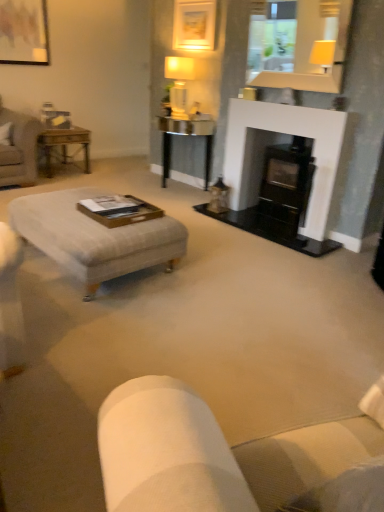
Question: Does matte white lamp at upper center have a greater width compared to matte gold picture frame at upper center, the 1th picture frame positioned from the right?

Choices:
 (A) no
 (B) yes

Answer: (B)

Question: From the image's perspective, is matte white lamp at upper center above matte gold picture frame at upper center, the 1th picture frame positioned from the right?

Choices:
 (A) yes
 (B) no

Answer: (B)

Question: Is matte white lamp at upper center shorter than matte gold picture frame at upper center, the 1th picture frame positioned from the right?

Choices:
 (A) no
 (B) yes

Answer: (A)

Question: Can you confirm if matte white lamp at upper center is positioned to the left of matte gold picture frame at upper center, the 1th picture frame positioned from the right?

Choices:
 (A) no
 (B) yes

Answer: (B)

Question: From a real-world perspective, is matte white lamp at upper center under matte gold picture frame at upper center, the 1th picture frame positioned from the right?

Choices:
 (A) no
 (B) yes

Answer: (B)

Question: Is white matte fireplace at center spatially inside light gray fabric ottoman at center, or outside of it?

Choices:
 (A) outside
 (B) inside

Answer: (A)

Question: In terms of size, does white matte fireplace at center appear bigger or smaller than light gray fabric ottoman at center?

Choices:
 (A) small
 (B) big

Answer: (A)

Question: Considering the positions of point (329, 116) and point (44, 199), is point (329, 116) closer or farther from the camera than point (44, 199)?

Choices:
 (A) farther
 (B) closer

Answer: (A)

Question: From the image's perspective, is white matte fireplace at center located above or below light gray fabric ottoman at center?

Choices:
 (A) below
 (B) above

Answer: (B)

Question: Considering the positions of point (177, 31) and point (41, 31), is point (177, 31) closer or farther from the camera than point (41, 31)?

Choices:
 (A) closer
 (B) farther

Answer: (A)

Question: From a real-world perspective, is matte gold picture frame at upper center, placed as the 2th picture frame when sorted from left to right, positioned above or below matte wooden picture frame at upper left, placed as the second picture frame when sorted from right to left?

Choices:
 (A) above
 (B) below

Answer: (A)

Question: From the image's perspective, is matte gold picture frame at upper center, placed as the 2th picture frame when sorted from left to right, above or below matte wooden picture frame at upper left, placed as the 1th picture frame when sorted from left to right?

Choices:
 (A) above
 (B) below

Answer: (B)

Question: Is matte gold picture frame at upper center, placed as the 2th picture frame when sorted from left to right, taller or shorter than matte wooden picture frame at upper left, placed as the 1th picture frame when sorted from left to right?

Choices:
 (A) tall
 (B) short

Answer: (B)

Question: Would you say metallic gold table at left, marked as the 2th table in a right-to-left arrangement, is to the left or to the right of matte glass mirror at upper center in the picture?

Choices:
 (A) right
 (B) left

Answer: (B)

Question: In terms of height, does metallic gold table at left, marked as the first table in a left-to-right arrangement, look taller or shorter compared to matte glass mirror at upper center?

Choices:
 (A) tall
 (B) short

Answer: (B)